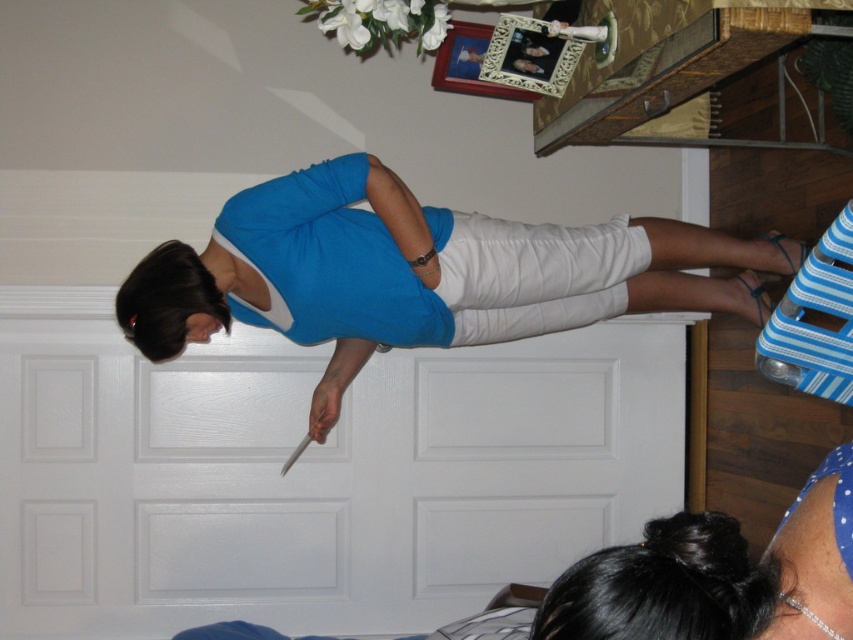
How much distance is there between blue cotton dress at center and matte blue fabric dress at center?

A distance of 1.46 inches exists between blue cotton dress at center and matte blue fabric dress at center.

Measure the distance between point (430, 214) and camera.

A distance of 6.88 feet exists between point (430, 214) and camera.

Is point (322, 410) less distant than point (279, 218)?

No, it is behind (279, 218).

At what (x,y) coordinates should I click in order to perform the action: click on blue cotton dress at center. Please return your answer as a coordinate pair (x, y). The height and width of the screenshot is (640, 853). Looking at the image, I should click on (410, 273).